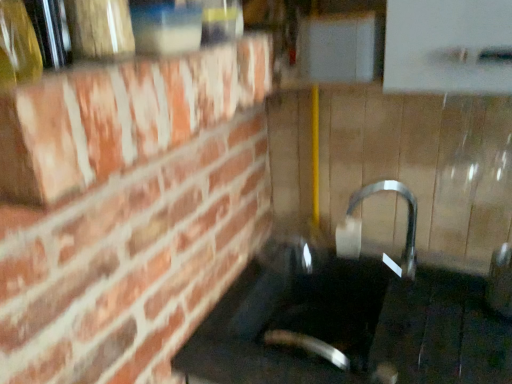
Question: Should I look upward or downward to see translucent glass bottle at upper left?

Choices:
 (A) down
 (B) up

Answer: (B)

Question: Is black glass sink at center positioned beyond the bounds of translucent glass bottle at upper left?

Choices:
 (A) no
 (B) yes

Answer: (B)

Question: Can translucent glass bottle at upper left be found inside black glass sink at center?

Choices:
 (A) no
 (B) yes

Answer: (A)

Question: From a real-world perspective, is black glass sink at center beneath translucent glass bottle at upper left?

Choices:
 (A) yes
 (B) no

Answer: (A)

Question: Does black glass sink at center have a larger size compared to translucent glass bottle at upper left?

Choices:
 (A) no
 (B) yes

Answer: (B)

Question: Are black glass sink at center and translucent glass bottle at upper left making contact?

Choices:
 (A) no
 (B) yes

Answer: (A)

Question: Does black glass sink at center have a lesser height compared to translucent glass bottle at upper left?

Choices:
 (A) yes
 (B) no

Answer: (B)

Question: Can you confirm if translucent glass bottle at upper left is shorter than black glass sink at center?

Choices:
 (A) no
 (B) yes

Answer: (B)

Question: Considering the relative sizes of translucent glass bottle at upper left and black glass sink at center in the image provided, is translucent glass bottle at upper left bigger than black glass sink at center?

Choices:
 (A) no
 (B) yes

Answer: (A)

Question: Is translucent glass bottle at upper left not near black glass sink at center?

Choices:
 (A) yes
 (B) no

Answer: (B)

Question: From the image's perspective, would you say translucent glass bottle at upper left is shown under black glass sink at center?

Choices:
 (A) no
 (B) yes

Answer: (A)

Question: Does translucent glass bottle at upper left have a smaller size compared to black glass sink at center?

Choices:
 (A) no
 (B) yes

Answer: (B)

Question: Is black glass sink at center located within translucent glass bottle at upper left?

Choices:
 (A) no
 (B) yes

Answer: (A)

Question: Does translucent glass bottle at upper left have a larger size compared to satin nickel faucet at center?

Choices:
 (A) no
 (B) yes

Answer: (A)